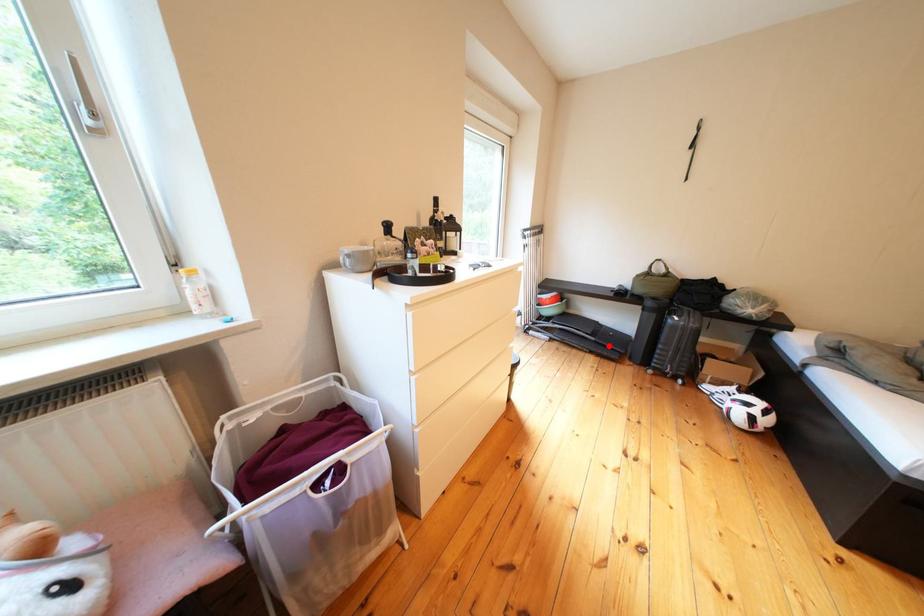
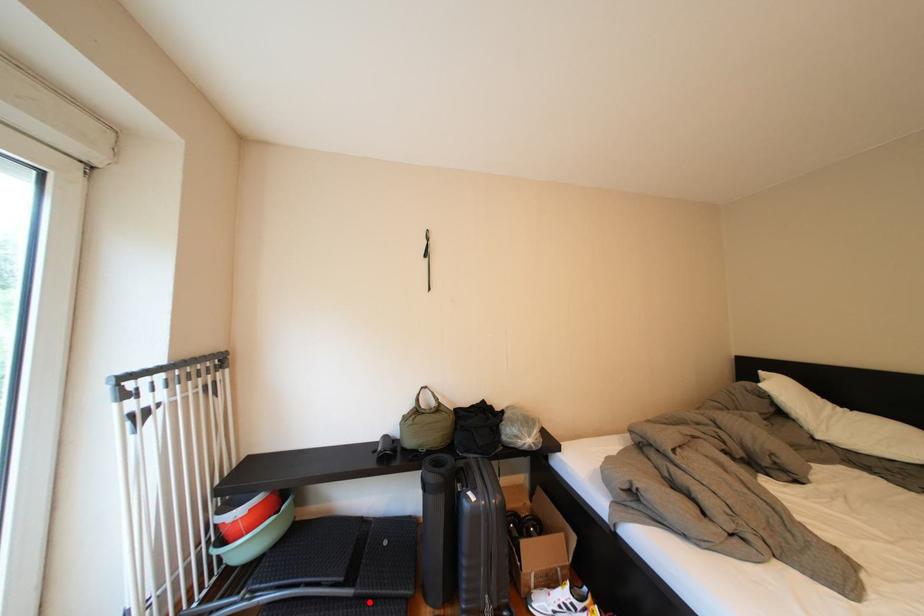
I am providing you with two images of the same scene from different viewpoints. A red point is marked on the first image and another point is marked on the second image. Is the red point in image1 aligned with the point shown in image2?

Yes